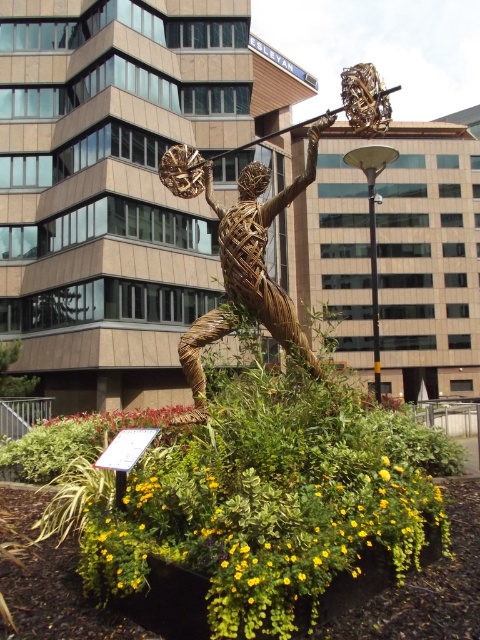
Question: Where is black metal pole at center located in relation to yellowmaterial/texturepole at center in the image?

Choices:
 (A) below
 (B) above

Answer: (B)

Question: Is braided wicker figure at center positioned at the back of yellowmaterial/texturepole at center?

Choices:
 (A) yes
 (B) no

Answer: (B)

Question: Among these points, which one is farthest from the camera?

Choices:
 (A) (372, 320)
 (B) (225, 237)
 (C) (372, 273)

Answer: (C)

Question: Is yellow-green leaves at center below braided wicker figure at center?

Choices:
 (A) yes
 (B) no

Answer: (A)

Question: Which of these objects is positioned closest to the black metal pole at center?

Choices:
 (A) yellow-green leaves at center
 (B) yellowmaterial/texturepole at center

Answer: (B)

Question: Among these objects, which one is nearest to the camera?

Choices:
 (A) braided wicker figure at center
 (B) black metal pole at center
 (C) yellow-green leaves at center

Answer: (C)